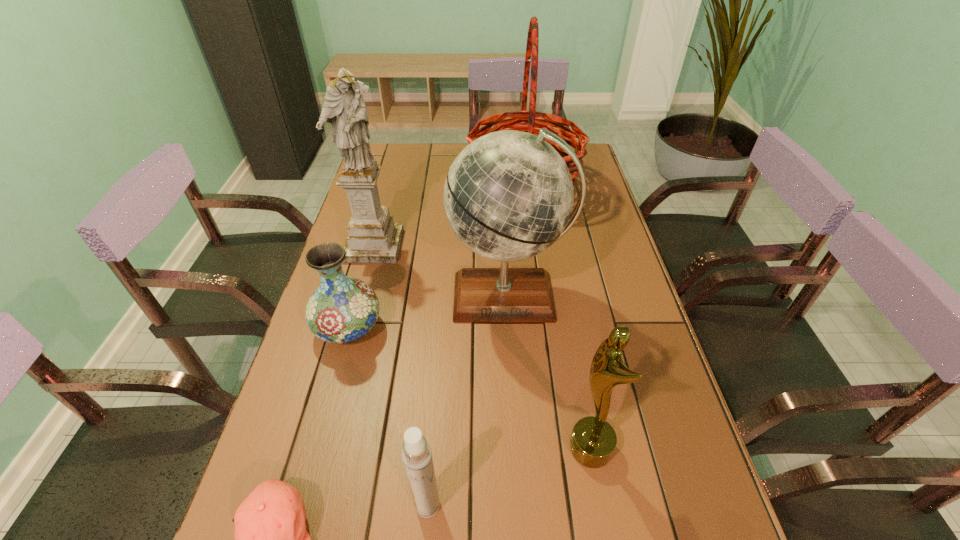
The image size is (960, 540). I want to click on vacant space located 0.400m on the front-facing side of the sculpture, so click(x=338, y=382).

Where is `free location located at the equator of the globe`? The width and height of the screenshot is (960, 540). free location located at the equator of the globe is located at coordinates (515, 400).

I want to click on blank area located 0.120m on the front-facing side of the fourth shortest object, so click(x=510, y=449).

The width and height of the screenshot is (960, 540). What are the coordinates of `vacant point located on the front-facing side of the fourth shortest object` in the screenshot? It's located at (425, 449).

Locate an element on the screen. free space located 0.070m on the front-facing side of the fourth shortest object is located at coordinates (535, 449).

Where is `vacant space located on the left of the aerosol can`? This screenshot has height=540, width=960. vacant space located on the left of the aerosol can is located at coordinates (275, 505).

In order to click on free point located on the front of the vase in this screenshot , I will do `click(329, 396)`.

Where is `object positioned at the far edge`? object positioned at the far edge is located at coordinates (533, 124).

Where is `sculpture that is positioned at the left edge`? sculpture that is positioned at the left edge is located at coordinates (373, 237).

This screenshot has width=960, height=540. I want to click on vase at the left edge, so click(342, 309).